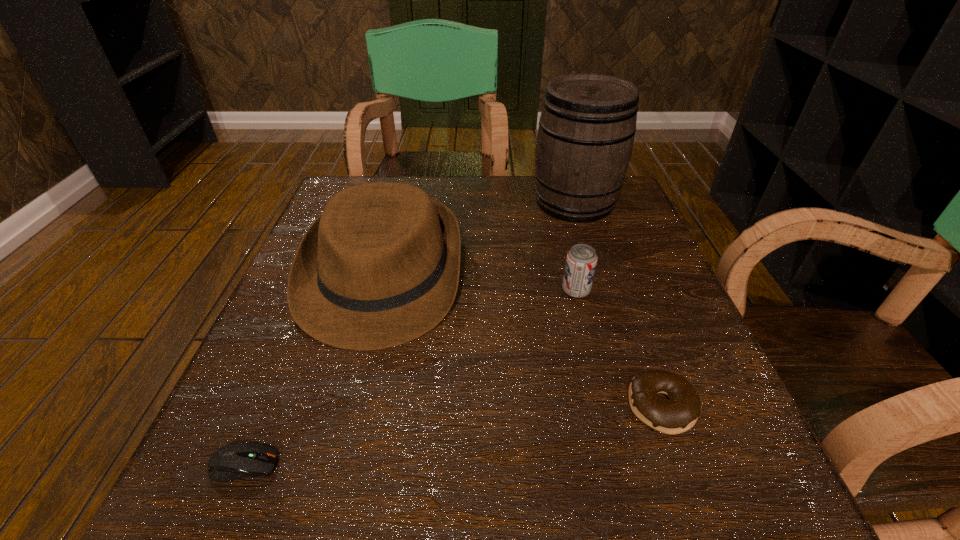
The height and width of the screenshot is (540, 960). I want to click on free space that satisfies the following two spatial constraints: 1. on the front side of the tallest object; 2. on the button of the shortest object, so pos(655,465).

At what (x,y) coordinates should I click in order to perform the action: click on free spot that satisfies the following two spatial constraints: 1. on the front side of the fourth tallest object; 2. on the right side of the wine bucket. Please return your answer as a coordinate pair (x, y). This screenshot has height=540, width=960. Looking at the image, I should click on (636, 406).